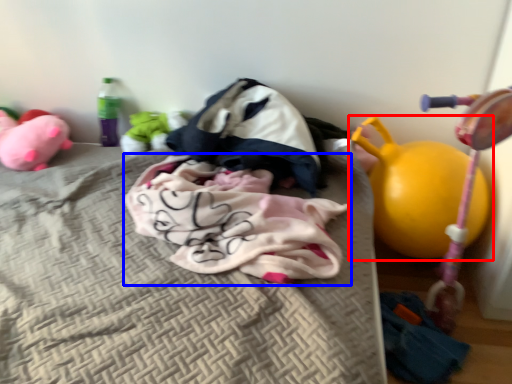
Question: Which object is further to the camera taking this photo, toy (highlighted by a red box) or baby clothe (highlighted by a blue box)?

Choices:
 (A) toy
 (B) baby clothe

Answer: (A)